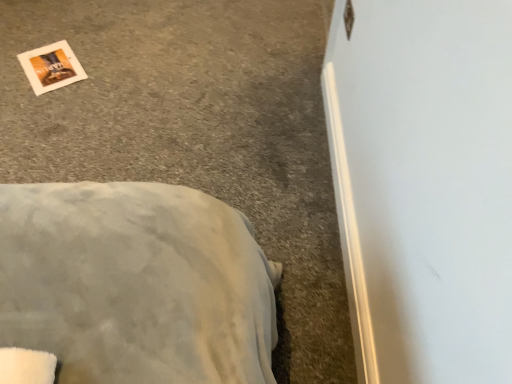
At what (x,y) coordinates should I click in order to perform the action: click on vacant area that is in front of white paper at upper left. Please return your answer as a coordinate pair (x, y). This screenshot has height=384, width=512. Looking at the image, I should click on (37, 101).